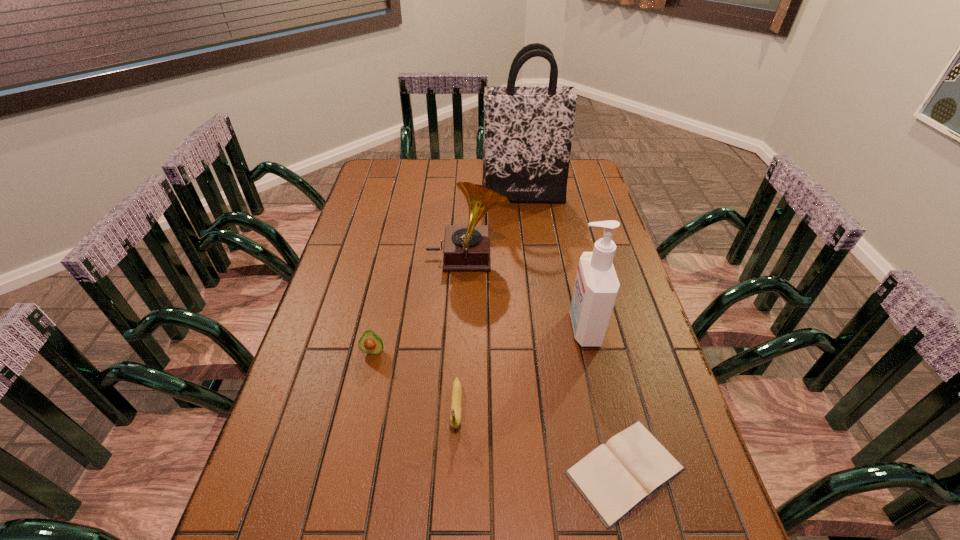
This screenshot has width=960, height=540. I want to click on free space between the leftmost object and the banana, so click(x=415, y=379).

Where is `vacant space in between the shopping bag and the Bible`? The height and width of the screenshot is (540, 960). vacant space in between the shopping bag and the Bible is located at coordinates (574, 333).

Identify the location of empty location between the banana and the second tallest object. (520, 367).

Image resolution: width=960 pixels, height=540 pixels. Find the location of `free space between the leftmost object and the second tallest object`. free space between the leftmost object and the second tallest object is located at coordinates (479, 339).

Find the location of `free spot between the tallest object and the cleansing agent`. free spot between the tallest object and the cleansing agent is located at coordinates (553, 261).

Where is `vacant space in between the cleansing agent and the leftmost object`? The image size is (960, 540). vacant space in between the cleansing agent and the leftmost object is located at coordinates (479, 339).

I want to click on the third closest object to the shopping bag, so click(x=371, y=343).

Choose which object is the second nearest neighbor to the Bible. Please provide its 2D coordinates. Your answer should be formatted as a tuple, i.e. [(x, y)], where the tuple contains the x and y coordinates of a point satisfying the conditions above.

[(456, 396)]

I want to click on blank space that satisfies the following two spatial constraints: 1. from the horn of the phonograph record; 2. on the cut side of the leftmost object, so click(x=464, y=351).

The height and width of the screenshot is (540, 960). In order to click on vacant space that satisfies the following two spatial constraints: 1. from the horn of the phonograph record; 2. on the right side of the Bible in this screenshot , I will do tap(460, 470).